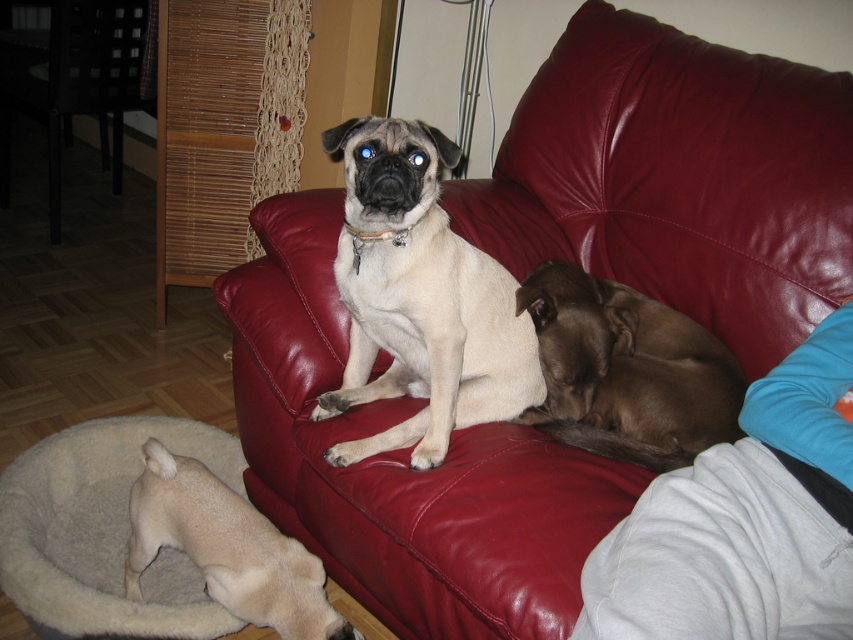
Question: Can you confirm if white fur dog at center is thinner than white fur dog at lower left?

Choices:
 (A) yes
 (B) no

Answer: (A)

Question: In this image, where is white fur dog at center located relative to dark wood chair at left?

Choices:
 (A) left
 (B) right

Answer: (B)

Question: Which of the following is the farthest from the observer?

Choices:
 (A) dark wood chair at left
 (B) beige plush dog bed at lower left

Answer: (A)

Question: Which point appears closest to the camera in this image?

Choices:
 (A) (227, 552)
 (B) (30, 513)
 (C) (538, 385)
 (D) (299, 266)

Answer: (A)

Question: Can you confirm if white fur dog at center is positioned to the right of dark wood chair at left?

Choices:
 (A) no
 (B) yes

Answer: (B)

Question: Among these points, which one is nearest to the camera?

Choices:
 (A) (59, 208)
 (B) (683, 316)
 (C) (339, 634)
 (D) (543, 200)

Answer: (C)